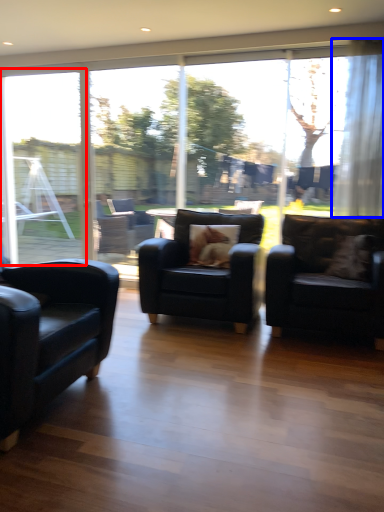
Question: Which object appears closest to the camera in this image, window frame (highlighted by a red box) or curtain (highlighted by a blue box)?

Choices:
 (A) window frame
 (B) curtain

Answer: (B)